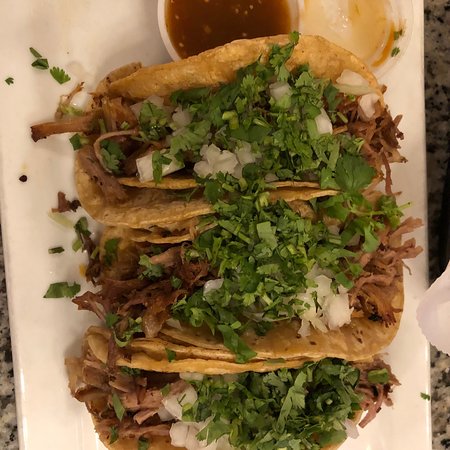
In order to click on napkin in this screenshot , I will do `click(431, 311)`.